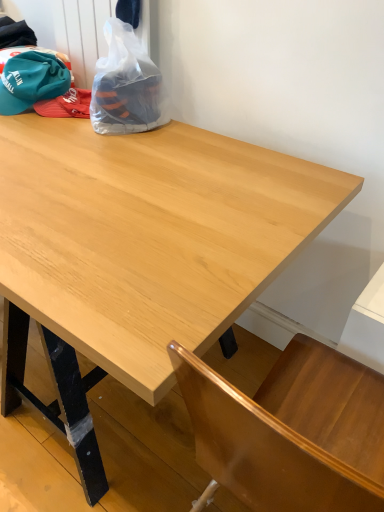
Question: From the image's perspective, is light wood table at center located above or below teal fabric baseball hat at upper left?

Choices:
 (A) above
 (B) below

Answer: (B)

Question: Looking at the image, does light wood table at center seem bigger or smaller compared to teal fabric baseball hat at upper left?

Choices:
 (A) small
 (B) big

Answer: (B)

Question: Estimate the real-world distances between objects in this image. Which object is closer to the teal fabric baseball hat at upper left?

Choices:
 (A) light wood table at center
 (B) transparent plastic bag at upper left

Answer: (B)

Question: Considering the real-world distances, which object is closest to the teal fabric baseball hat at upper left?

Choices:
 (A) transparent plastic bag at upper left
 (B) light wood table at center

Answer: (A)